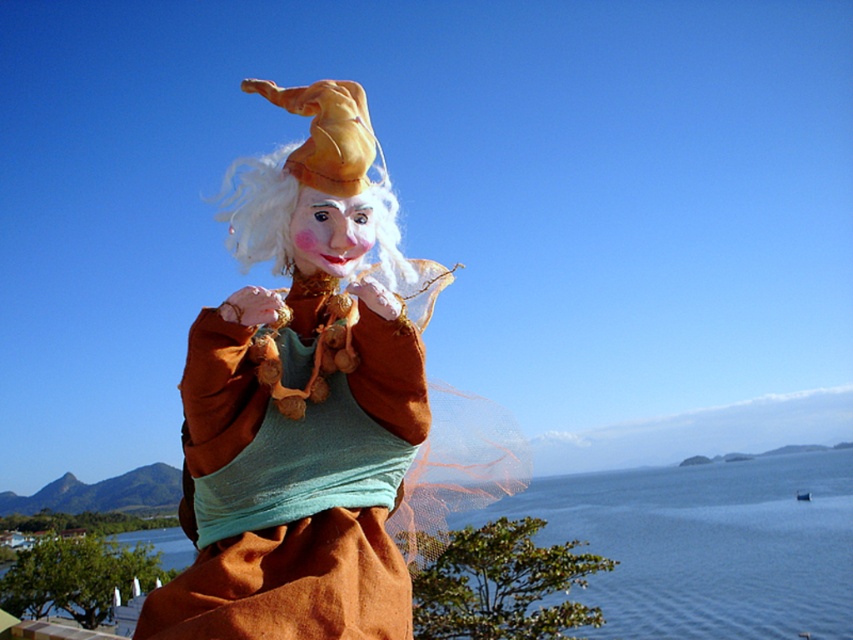
You are standing in front of the puppet figure and want to place two markers at the coordinates point (321, 342) and point (265, 173). Which marker will be closer to you?

Point (321, 342) is in front of point (265, 173), so the marker at point (321, 342) will be closer to you.

You are an artist planning to paint this scene. You want to ensure the matte brown doll at center and the blue water at center are both visible. Given their sizes, which object should you focus on placing first to ensure it doesn

The matte brown doll at center occupies less space than blue water at center, so you should focus on placing the blue water at center first since it takes up more space and will form the main background element before detailing the smaller doll.

You are an artist planning to paint the scene. You want to ensure the matte brown doll at center is proportionally smaller than the blue water at center. Does the current arrangement allow this?

Yes, the matte brown doll at center is not as tall as the blue water at center, so the current arrangement allows the doll to be proportionally smaller than the water.